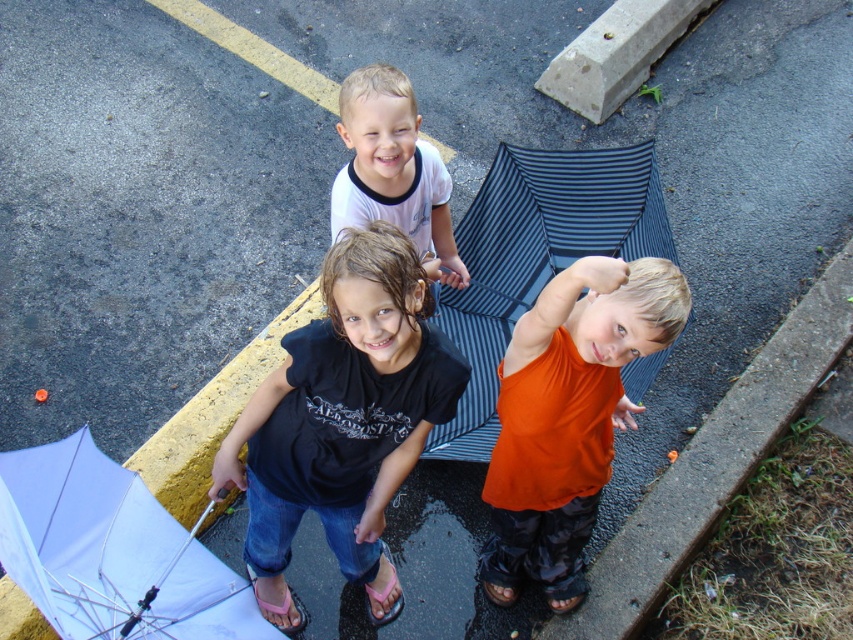
Question: Considering the real-world distances, which object is farthest from the white matte umbrella at lower left?

Choices:
 (A) pink rubber sandal at lower center
 (B) orange cotton shirt at center
 (C) black rubber sandal at lower center

Answer: (C)

Question: Is orange cotton shirt at center to the right of brown leather sandal at lower center from the viewer's perspective?

Choices:
 (A) no
 (B) yes

Answer: (B)

Question: Does black matte shirt at center have a larger size compared to white cotton shirt at upper center?

Choices:
 (A) yes
 (B) no

Answer: (A)

Question: Which point is closer to the camera?

Choices:
 (A) white matte umbrella at lower left
 (B) brown leather sandal at lower center
 (C) pink fabric sandal at lower center

Answer: (A)

Question: Which object appears closest to the camera in this image?

Choices:
 (A) white cotton shirt at upper center
 (B) black rubber sandal at lower center

Answer: (A)

Question: Does white cotton shirt at upper center appear on the right side of brown leather sandal at lower center?

Choices:
 (A) no
 (B) yes

Answer: (A)